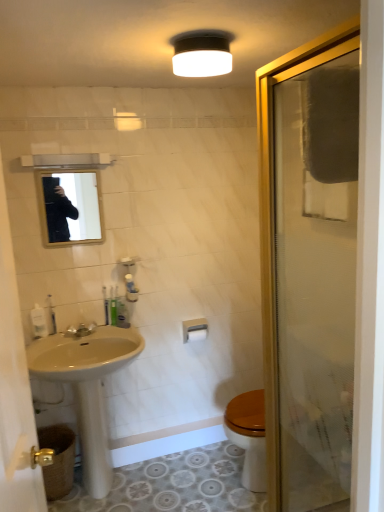
The height and width of the screenshot is (512, 384). In order to click on vacant area on top of white matte light fixture at upper center (from a real-world perspective) in this screenshot , I will do `click(203, 39)`.